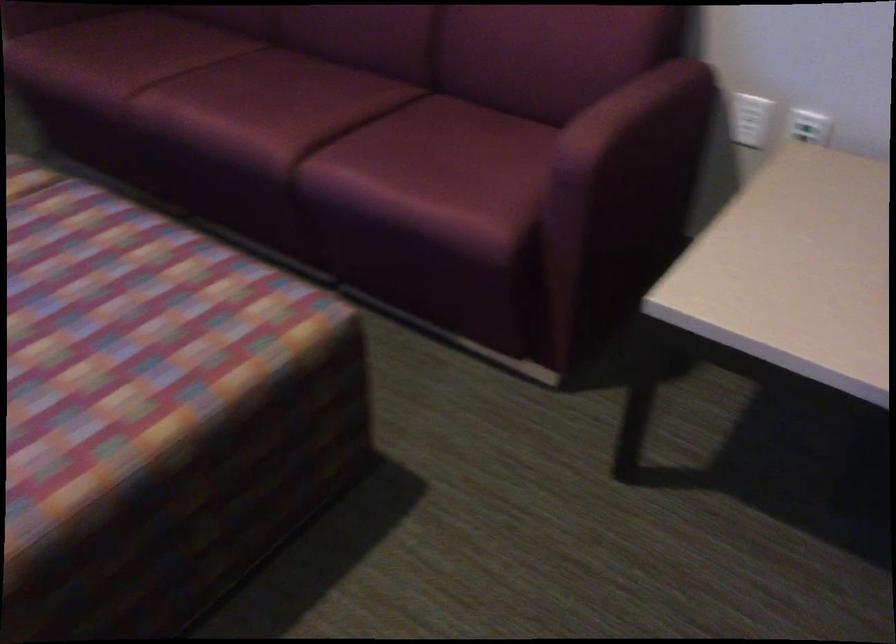
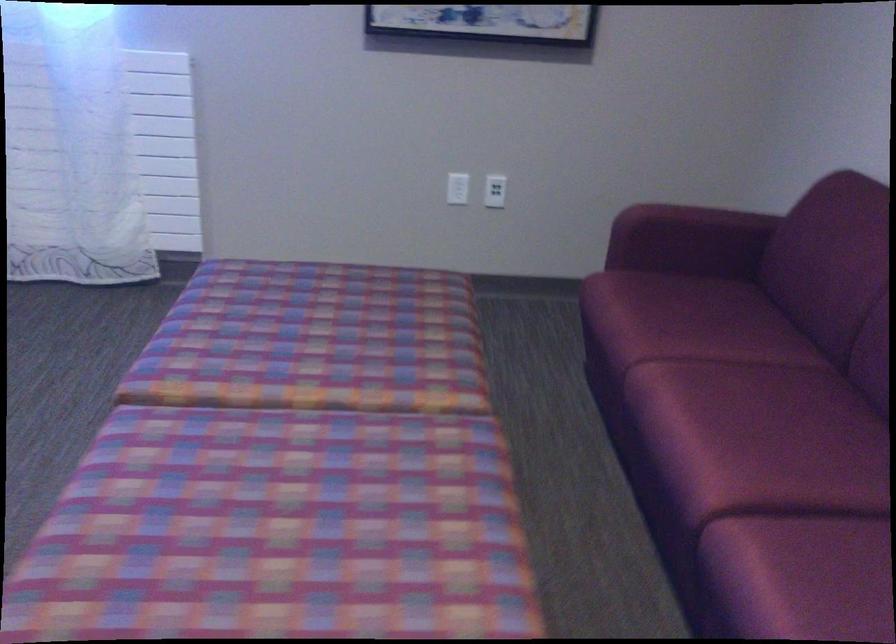
Question: The camera is either moving clockwise (left) or counter-clockwise (right) around the object. The first image is from the beginning of the video and the second image is from the end. Is the camera moving left or right when shooting the video?

Choices:
 (A) Left
 (B) Right

Answer: (B)